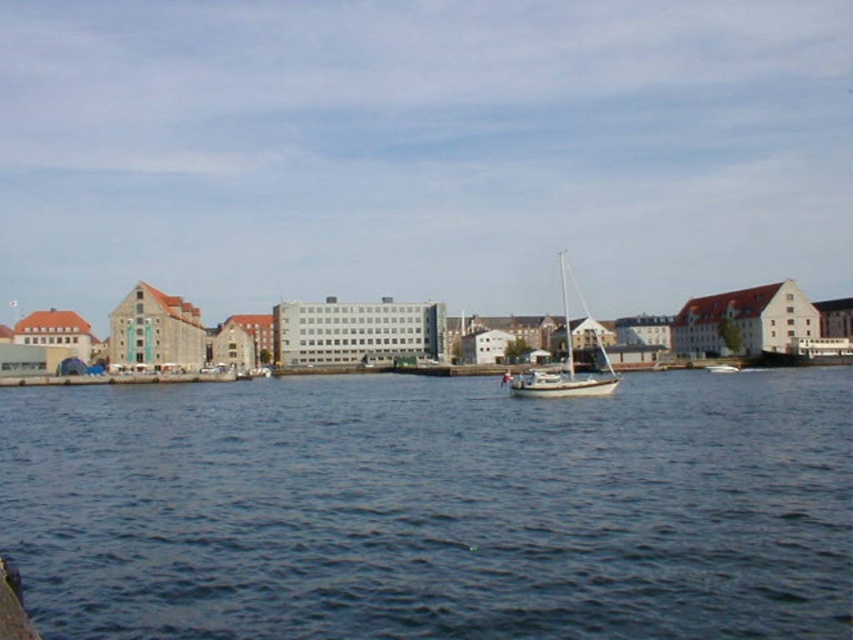
You are standing on the dock and looking at the blue water at center and the white matte sailboat at center. Which object appears taller in the scene?

The white matte sailboat at center appears taller than the blue water at center.

Based on the photo, you are standing on the dock and see the blue water at center and the white matte sailboat at center. Which object is positioned to the left side of the other?

The blue water at center is to the left of the white matte sailboat at center according to the description.

You are standing on the dock and want to throw a ball to your friend who is on the small sailboat with a white hull anchored near the center right. The blue water at center separates you two. How far apart are you and your friend?

The distance between you and your friend is 35.67 meters.